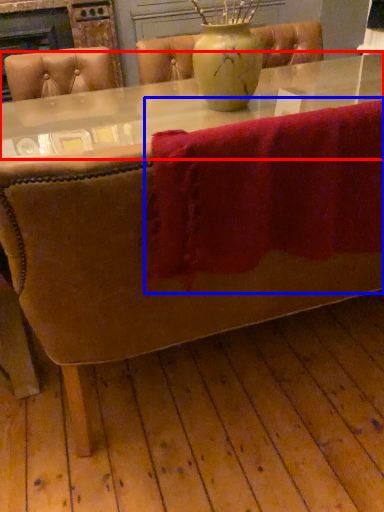
Question: Which object is closer to the camera taking this photo, round table (highlighted by a red box) or bath towel (highlighted by a blue box)?

Choices:
 (A) round table
 (B) bath towel

Answer: (B)